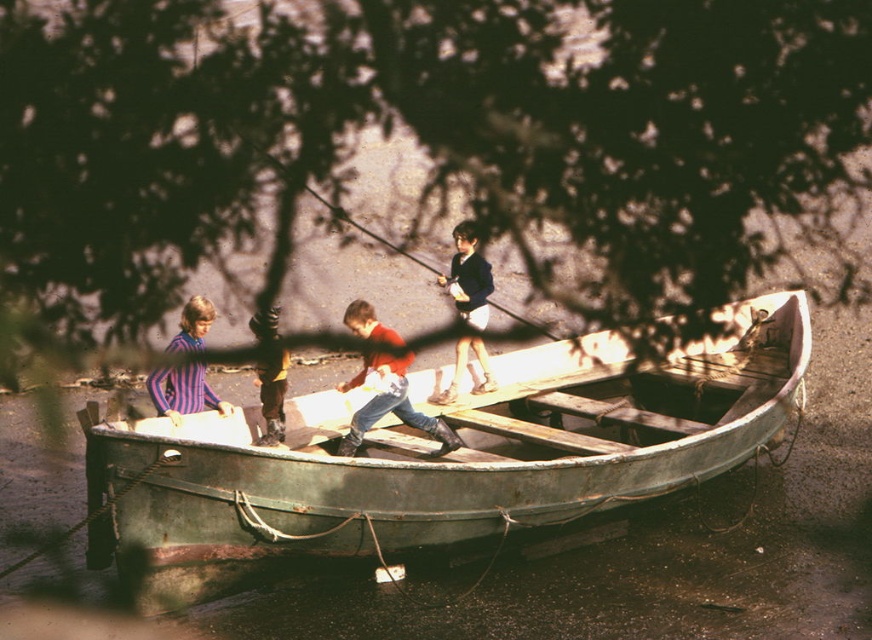
From the picture: You are a photographer standing on the shore observing the green wooden boat at center and the red matte shirt at center. Which object is closer to you?

The green wooden boat at center is closer to you than the red matte shirt at center.

What is the color of the clothing worn by the child located at the coordinates point (468, 276)?

The point (468, 276) corresponds to the dark blue sweater at center, so the color is dark blue.

From the picture: You are a parent supervising the children by the water. You notice the green wooden boat at center and the yellow fabric pants at center. Which object is wider?

The green wooden boat at center is wider than the yellow fabric pants at center.